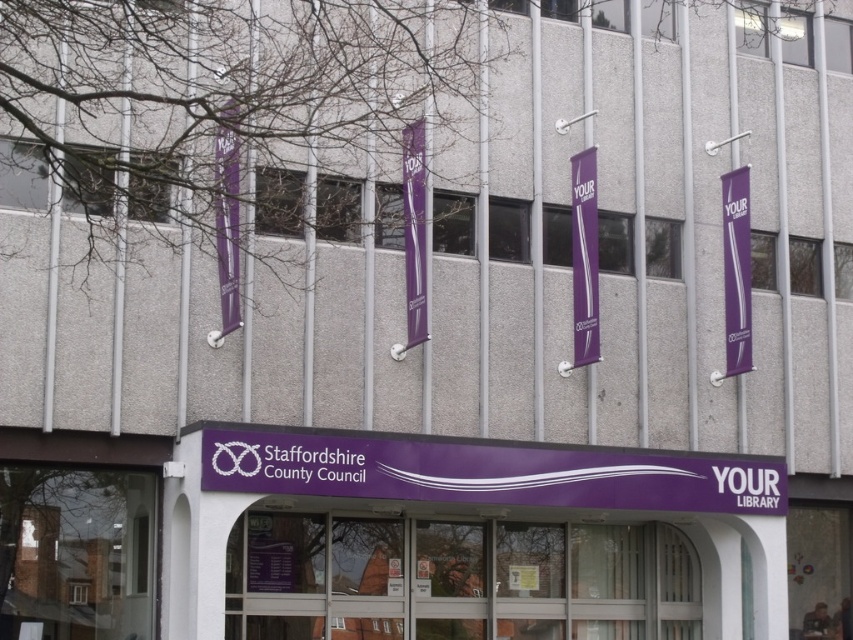
Question: Is purple fabric banner at right positioned in front of purple fabric banner at center?

Choices:
 (A) yes
 (B) no

Answer: (B)

Question: Among these objects, which one is nearest to the camera?

Choices:
 (A) purple matte signboard at center
 (B) purple fabric banner at center

Answer: (A)

Question: Does purple fabric banner at right appear on the left side of purple fabric banner at center?

Choices:
 (A) no
 (B) yes

Answer: (A)

Question: Which object is closer to the camera taking this photo?

Choices:
 (A) purple fabric banner at right
 (B) purple fabric banner at center

Answer: (B)

Question: Is purple fabric banner at right smaller than purple fabric banner at center?

Choices:
 (A) no
 (B) yes

Answer: (B)

Question: Which point is farther to the camera?

Choices:
 (A) purple fabric banner at center
 (B) purple fabric banner at right
 (C) purple matte signboard at center

Answer: (B)